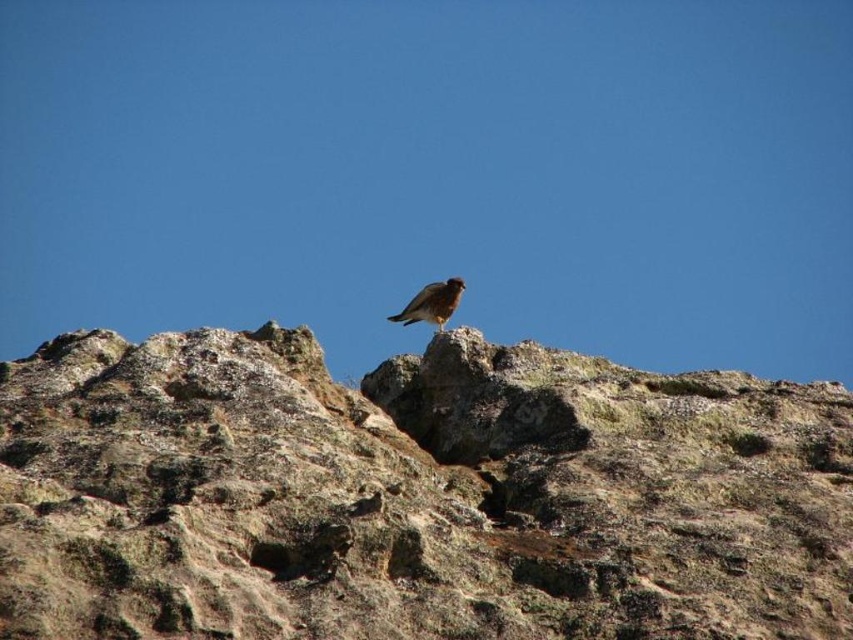
Question: Which of the following is the closest to the observer?

Choices:
 (A) (405, 314)
 (B) (57, 528)

Answer: (B)

Question: Which object is farther from the camera taking this photo?

Choices:
 (A) brown rough rock at center
 (B) brown feathered bird at upper center

Answer: (B)

Question: Does brown rough rock at center have a larger size compared to brown feathered bird at upper center?

Choices:
 (A) yes
 (B) no

Answer: (A)

Question: Is brown rough rock at center above brown feathered bird at upper center?

Choices:
 (A) yes
 (B) no

Answer: (B)

Question: Can you confirm if brown rough rock at center is positioned below brown feathered bird at upper center?

Choices:
 (A) no
 (B) yes

Answer: (B)

Question: Among these objects, which one is nearest to the camera?

Choices:
 (A) brown rough rock at center
 (B) brown feathered bird at upper center

Answer: (A)